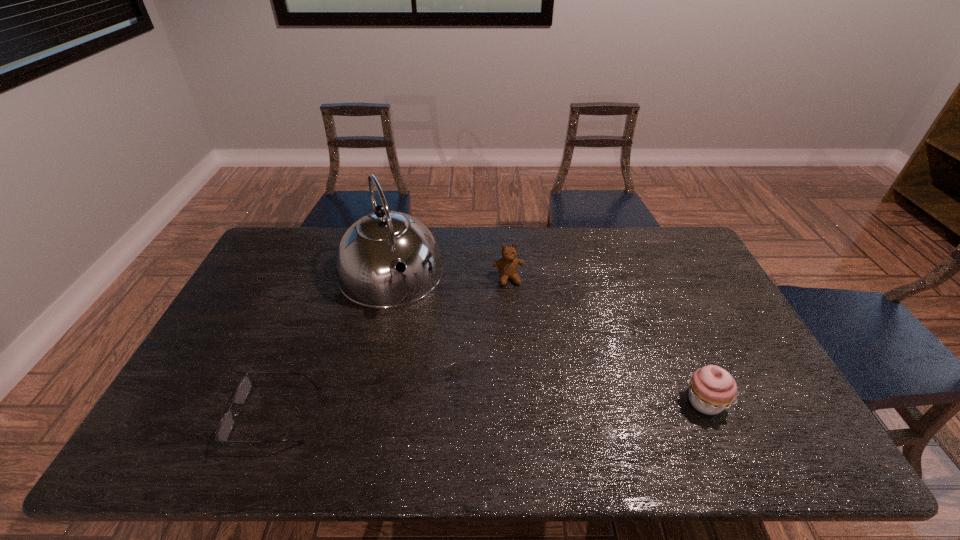
Image resolution: width=960 pixels, height=540 pixels. I want to click on free region located 0.370m from the spout of the tallest object, so click(x=444, y=408).

Where is `vacant space located on the front-facing side of the teddy bear`? This screenshot has width=960, height=540. vacant space located on the front-facing side of the teddy bear is located at coordinates (527, 347).

You are a GUI agent. You are given a task and a screenshot of the screen. Output one action in this format:
    pyautogui.click(x=<x>, y=<y>)
    Task: Click on the free location located on the front-facing side of the teddy bear
    
    Given the screenshot: What is the action you would take?
    pyautogui.click(x=515, y=300)

Find the location of a particular element. This screenshot has width=960, height=540. blank area located 0.170m on the front-facing side of the teddy bear is located at coordinates (521, 326).

I want to click on object that is at the far edge, so click(368, 252).

Where is `spectacles that is positioned at the near edge`? spectacles that is positioned at the near edge is located at coordinates (226, 424).

The width and height of the screenshot is (960, 540). What are the coordinates of `cupcake positioned at the near edge` in the screenshot? It's located at (712, 389).

The height and width of the screenshot is (540, 960). In order to click on object at the right edge in this screenshot , I will do `click(712, 389)`.

At what (x,y) coordinates should I click in order to perform the action: click on object that is at the near right corner. Please return your answer as a coordinate pair (x, y). Looking at the image, I should click on (712, 389).

Where is `vacant space at the far edge`? The height and width of the screenshot is (540, 960). vacant space at the far edge is located at coordinates (339, 245).